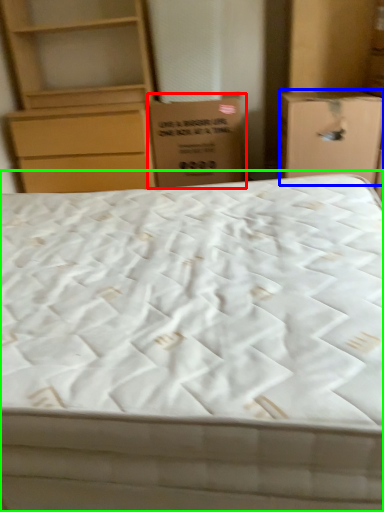
Question: Which object is the closest to the cardboard box (highlighted by a red box)? Choose among these: cardboard box (highlighted by a blue box) or bed (highlighted by a green box).

Choices:
 (A) cardboard box
 (B) bed

Answer: (A)